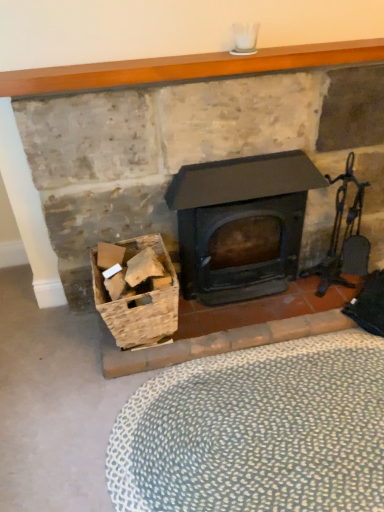
What are the coordinates of `free spot below white dotted rug at lower center (from a real-world perspective)` in the screenshot? It's located at (263, 425).